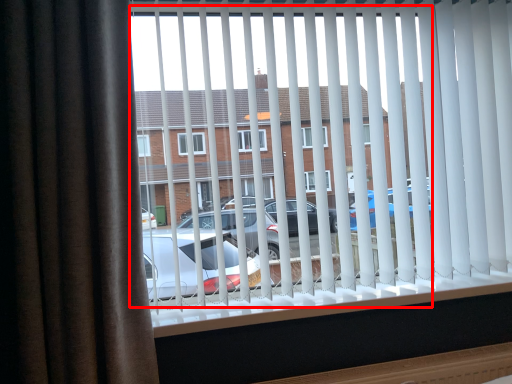
Question: Observing the image, what is the correct spatial positioning of bay window (annotated by the red box) in reference to curtain?

Choices:
 (A) left
 (B) right

Answer: (B)